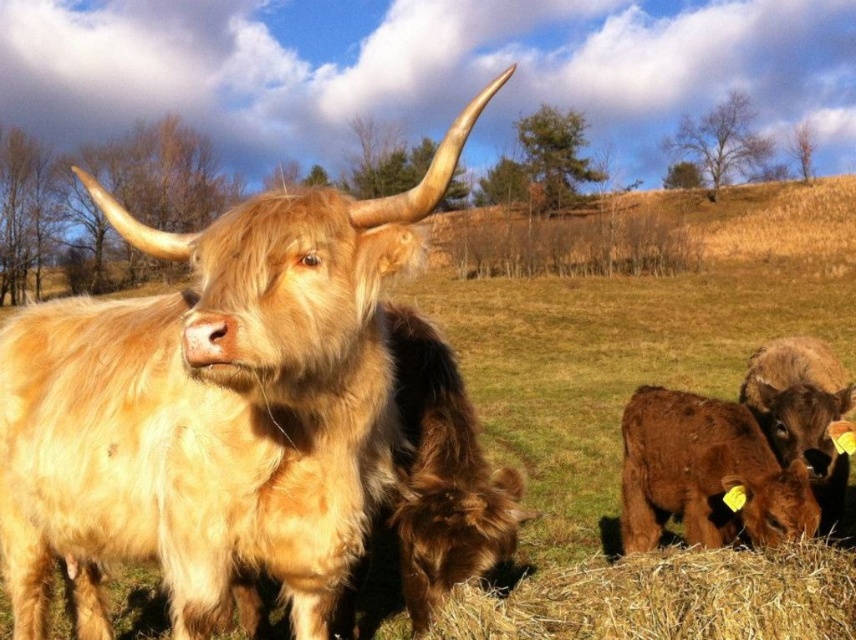
From the picture: Who is lower down, golden woolen bull at center or brown fuzzy calf at lower right?

Positioned lower is brown fuzzy calf at lower right.

Is golden woolen bull at center above brown fuzzy calf at lower right?

Correct, golden woolen bull at center is located above brown fuzzy calf at lower right.

Is point (242, 497) positioned in front of point (768, 506)?

Yes.

Locate an element on the screen. The image size is (856, 640). golden woolen bull at center is located at coordinates (212, 406).

Can you confirm if golden woolen bull at center is positioned above golden straw bale at lower right?

Indeed, golden woolen bull at center is positioned over golden straw bale at lower right.

Can you confirm if golden woolen bull at center is bigger than golden straw bale at lower right?

Yes, golden woolen bull at center is bigger than golden straw bale at lower right.

At what (x,y) coordinates should I click in order to perform the action: click on golden woolen bull at center. Please return your answer as a coordinate pair (x, y). The width and height of the screenshot is (856, 640). Looking at the image, I should click on (212, 406).

Can you confirm if golden straw bale at lower right is wider than brown fuzzy calf at lower right?

Yes, golden straw bale at lower right is wider than brown fuzzy calf at lower right.

Can you confirm if golden straw bale at lower right is positioned to the left of brown fuzzy calf at lower right?

Indeed, golden straw bale at lower right is positioned on the left side of brown fuzzy calf at lower right.

Does point (467, 593) come farther from viewer compared to point (758, 480)?

That is False.

You are a GUI agent. You are given a task and a screenshot of the screen. Output one action in this format:
    pyautogui.click(x=<x>, y=<y>)
    Task: Click on the golden straw bale at lower right
    Image resolution: width=856 pixels, height=640 pixels.
    Given the screenshot: What is the action you would take?
    (670, 596)